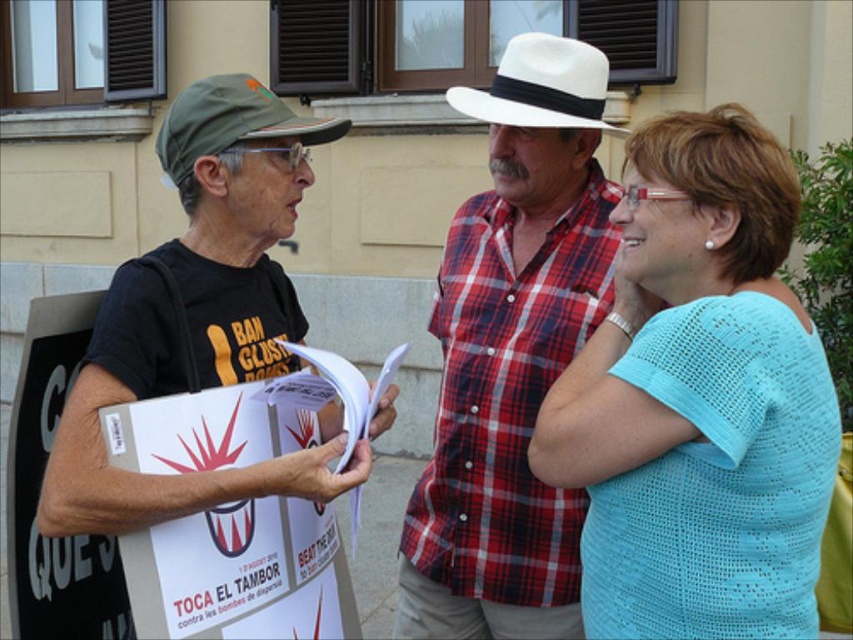
Question: Is light blue knit shirt at center to the left of matte black t-shirt at left from the viewer's perspective?

Choices:
 (A) yes
 (B) no

Answer: (B)

Question: Which object is the closest to the white felt cowboy hat at upper center?

Choices:
 (A) matte black t-shirt at left
 (B) white plaid shirt at center

Answer: (B)

Question: Is matte black t-shirt at left bigger than green fabric cap at left?

Choices:
 (A) yes
 (B) no

Answer: (A)

Question: Is white plaid shirt at center positioned in front of green fabric cap at left?

Choices:
 (A) no
 (B) yes

Answer: (A)

Question: Estimate the real-world distances between objects in this image. Which object is farther from the matte black t-shirt at left?

Choices:
 (A) white plaid shirt at center
 (B) white felt cowboy hat at upper center
 (C) green fabric cap at left
 (D) light blue knit shirt at center

Answer: (D)

Question: Which of the following is the farthest from the observer?

Choices:
 (A) matte black t-shirt at left
 (B) green fabric cap at left

Answer: (B)